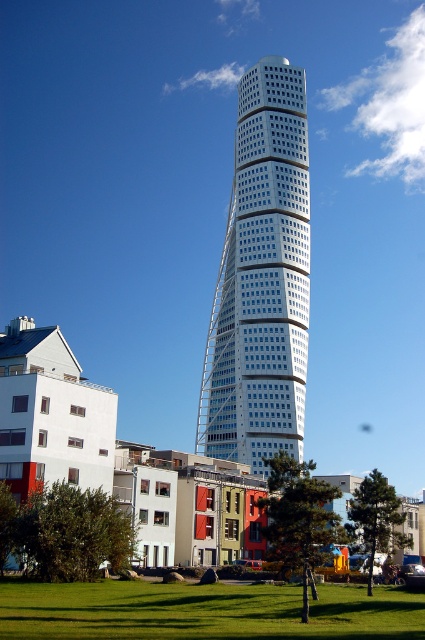
Between point (249, 106) and point (201, 612), which one is positioned in front?

Point (201, 612)

Is white glass skyscraper at center positioned in front of green grass at lower center?

No, it is not.

Does point (243, 244) come in front of point (30, 632)?

No, (243, 244) is further to viewer.

Identify the location of white glass skyscraper at center. The height and width of the screenshot is (640, 425). (261, 280).